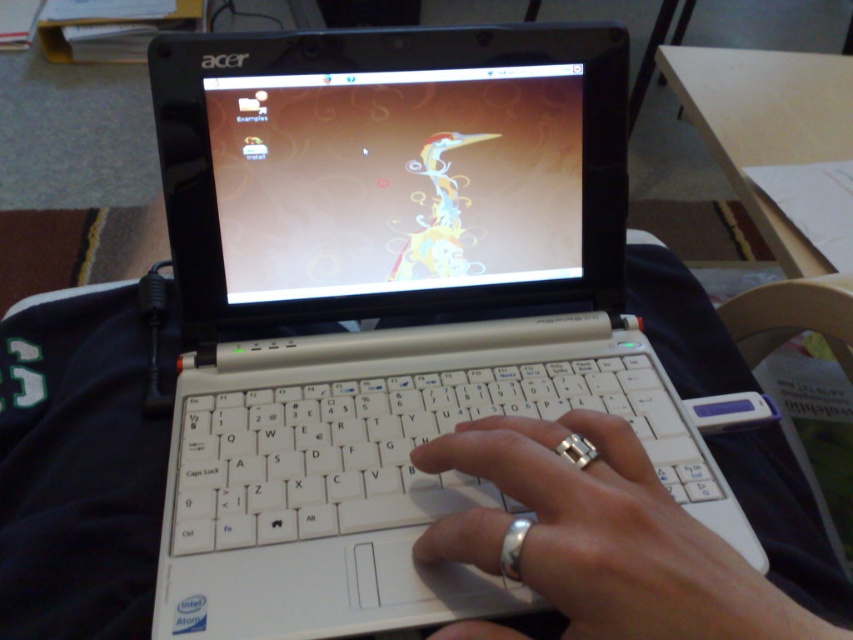
Question: Can you confirm if matte plastic screen at center is bigger than white plastic keyboard at center?

Choices:
 (A) no
 (B) yes

Answer: (A)

Question: Which of these objects is positioned farthest from the white plastic laptop at center?

Choices:
 (A) silver metallic ring at center
 (B) matte plastic screen at center
 (C) white plastic keyboard at center

Answer: (A)

Question: Estimate the real-world distances between objects in this image. Which object is farther from the silver metallic ring at center?

Choices:
 (A) white plastic laptop at center
 (B) matte plastic screen at center
 (C) white plastic keyboard at center

Answer: (B)

Question: Can you confirm if white plastic laptop at center is bigger than matte plastic screen at center?

Choices:
 (A) yes
 (B) no

Answer: (A)

Question: Does matte plastic screen at center appear on the right side of silver metallic ring at center?

Choices:
 (A) no
 (B) yes

Answer: (A)

Question: Which object is farther from the camera taking this photo?

Choices:
 (A) silver metallic ring at center
 (B) white plastic laptop at center

Answer: (B)